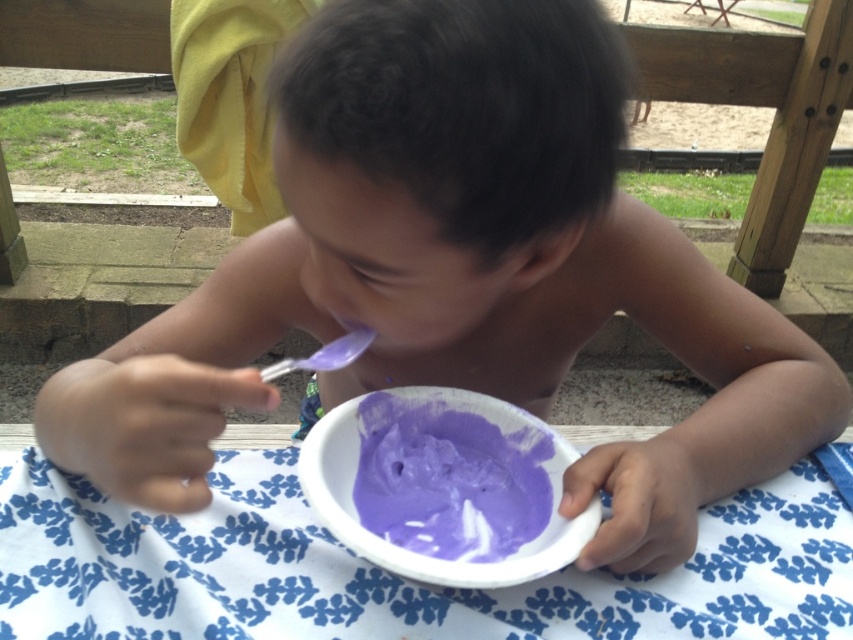
Question: Can you confirm if white fabric at center is positioned below purple matte food at center?

Choices:
 (A) no
 (B) yes

Answer: (B)

Question: Which of these objects is positioned farthest from the white fabric at center?

Choices:
 (A) transparent plastic spoon at center
 (B) purple matte food at center

Answer: (A)

Question: Is white fabric at center closer to the viewer compared to transparent plastic spoon at center?

Choices:
 (A) yes
 (B) no

Answer: (A)

Question: Which of the following is the farthest from the observer?

Choices:
 (A) white fabric at center
 (B) transparent plastic spoon at center

Answer: (B)

Question: Among these points, which one is farthest from the camera?

Choices:
 (A) (265, 378)
 (B) (360, 621)
 (C) (405, 547)

Answer: (C)

Question: Is purple matte food at center below transparent plastic spoon at center?

Choices:
 (A) yes
 (B) no

Answer: (A)